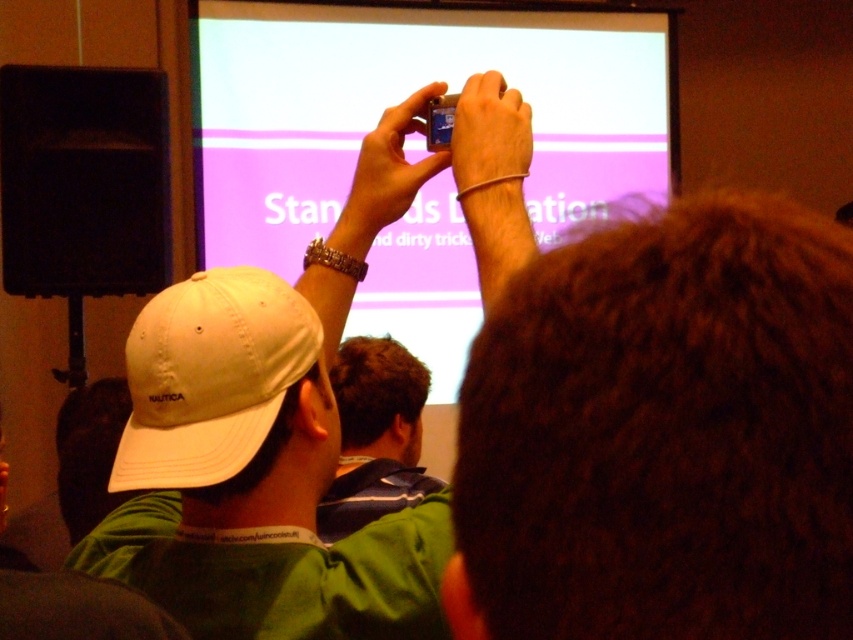
Which of these two, black matte speaker at left or white fabric baseball cap at left, stands taller?

With more height is black matte speaker at left.

Can you confirm if black matte speaker at left is shorter than white fabric baseball cap at left?

No.

At what (x,y) coordinates should I click in order to perform the action: click on black matte speaker at left. Please return your answer as a coordinate pair (x, y). The image size is (853, 640). Looking at the image, I should click on (83, 180).

Who is higher up, matte purple projector screen at upper center or white fabric baseball cap at left?

matte purple projector screen at upper center is higher up.

Can you confirm if matte purple projector screen at upper center is taller than white fabric baseball cap at left?

Yes, matte purple projector screen at upper center is taller than white fabric baseball cap at left.

Image resolution: width=853 pixels, height=640 pixels. What are the coordinates of `matte purple projector screen at upper center` in the screenshot? It's located at (402, 97).

The width and height of the screenshot is (853, 640). What are the coordinates of `matte purple projector screen at upper center` in the screenshot? It's located at (402, 97).

Who is positioned more to the left, white fabric cap at upper left or black matte speaker at left?

From the viewer's perspective, black matte speaker at left appears more on the left side.

Is point (180, 564) farther from camera compared to point (102, 291)?

That is False.

Locate an element on the screen. white fabric cap at upper left is located at coordinates (251, 480).